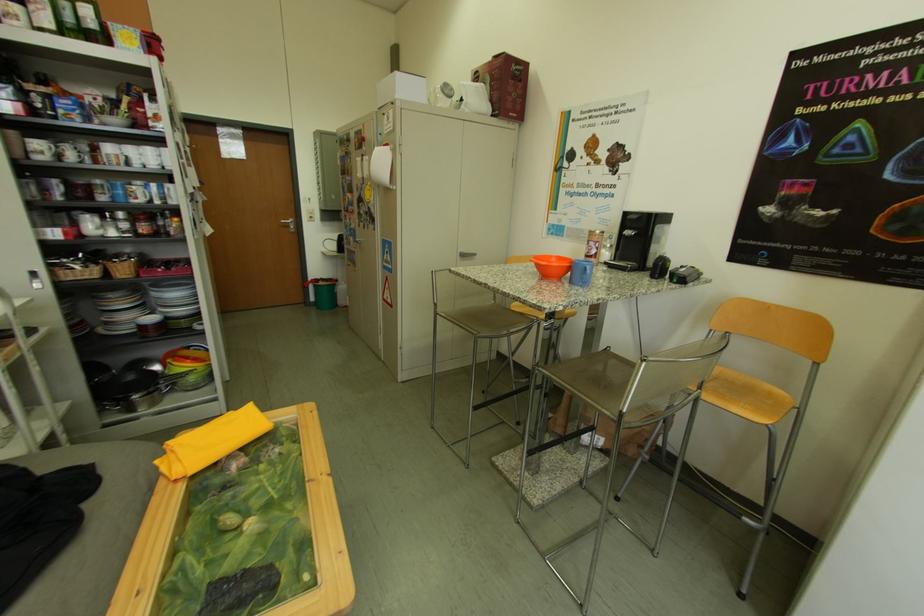
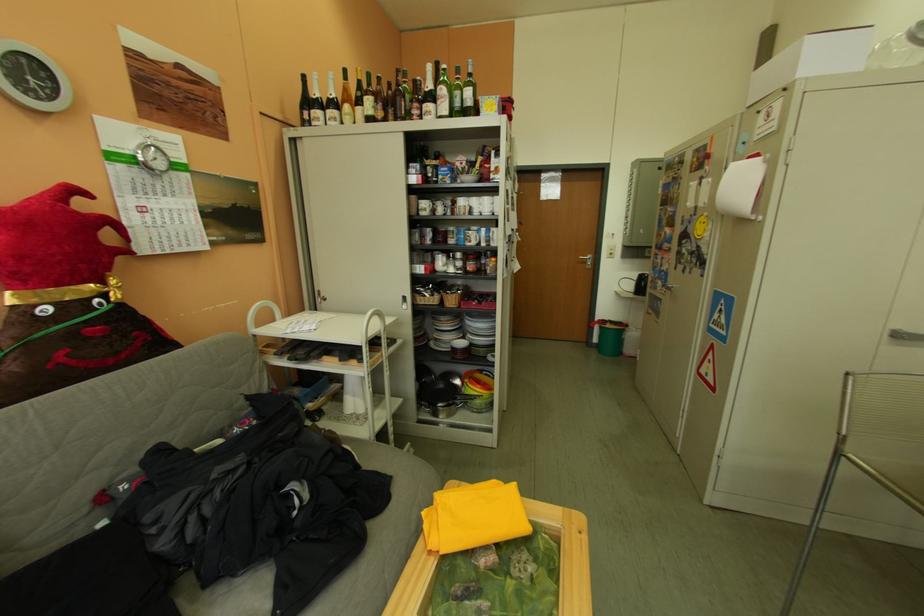
In the second image, find the point that corresponds to (x=86, y=270) in the first image.

(438, 299)